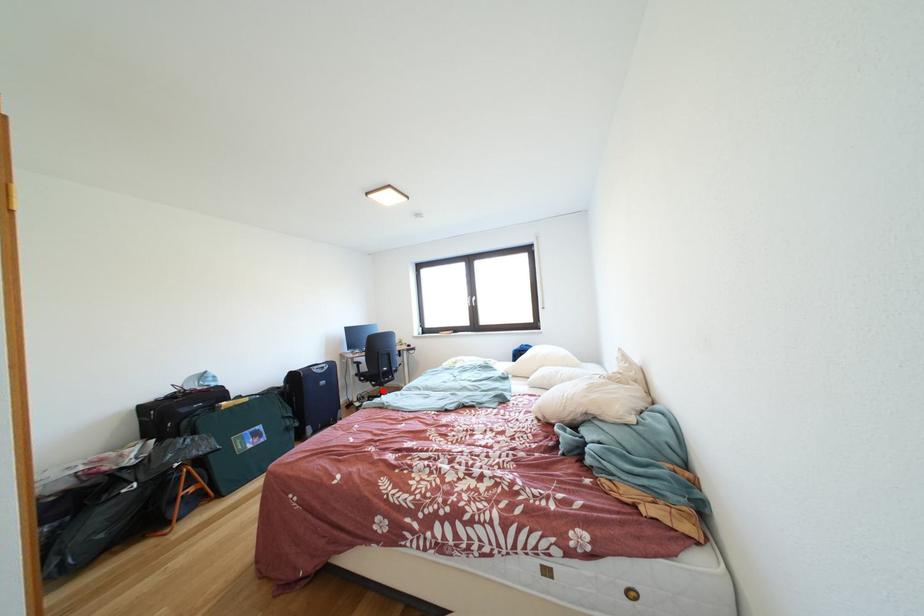
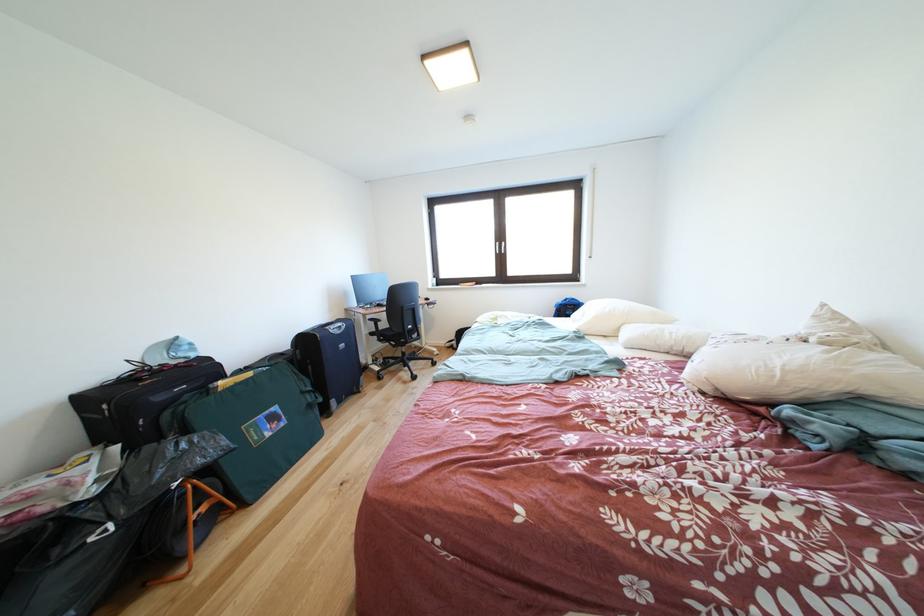
Question: I am providing you with two images of the same scene from different viewpoints. Given a red point in image1, look at the same physical point in image2. Is it:

Choices:
 (A) Closer to the viewpoint
 (B) Farther from the viewpoint

Answer: (A)